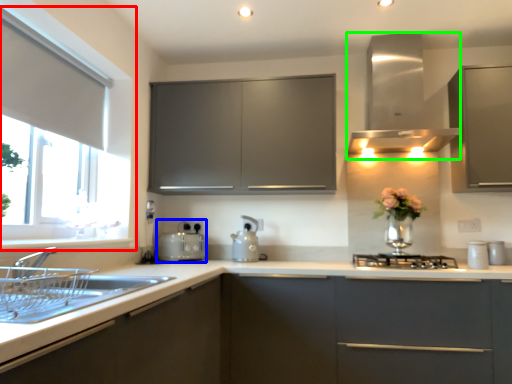
Question: Which object is positioned closest to window (highlighted by a red box)? Select from appliance (highlighted by a blue box) and vent (highlighted by a green box).

Choices:
 (A) appliance
 (B) vent

Answer: (A)